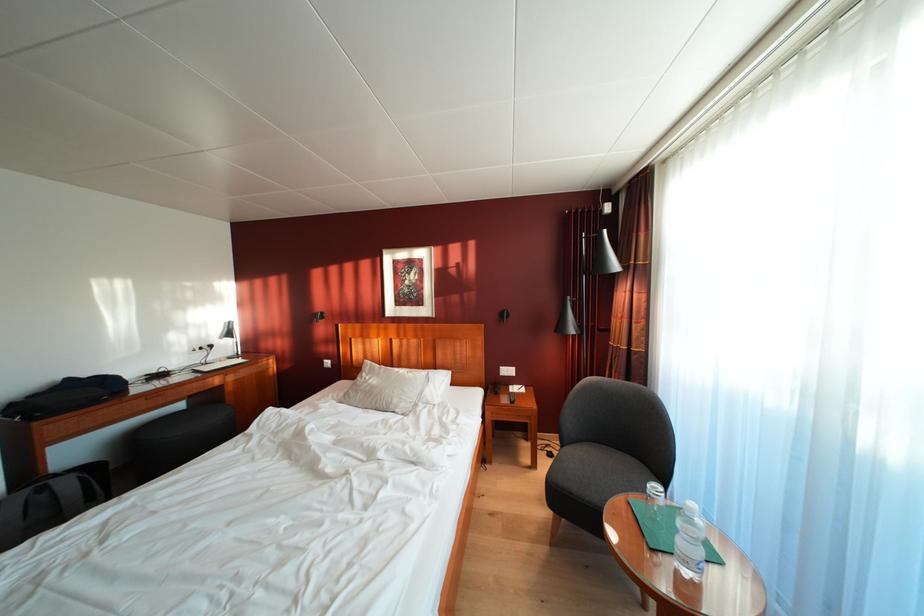
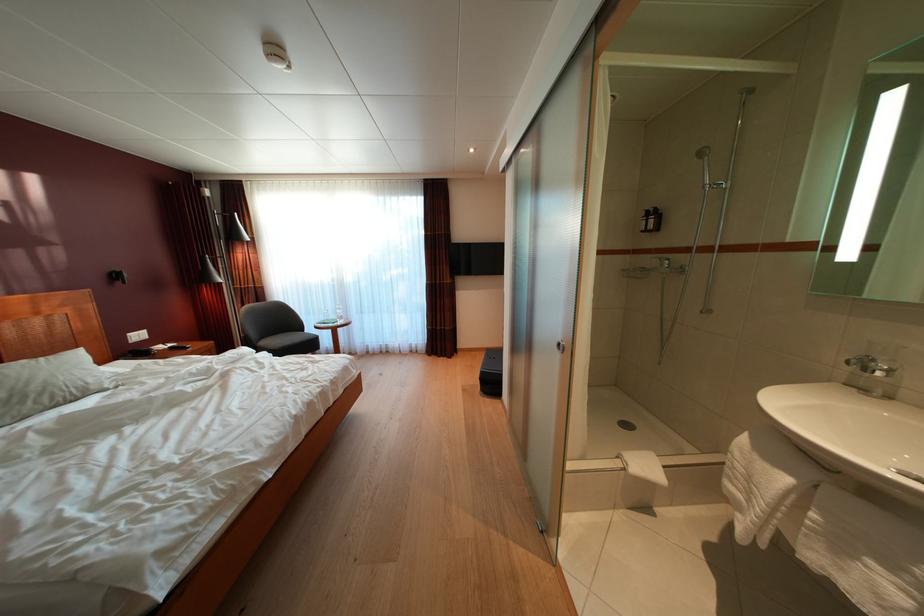
Locate, in the second image, the point that corresponds to the point at 375,395 in the first image.

(10, 400)